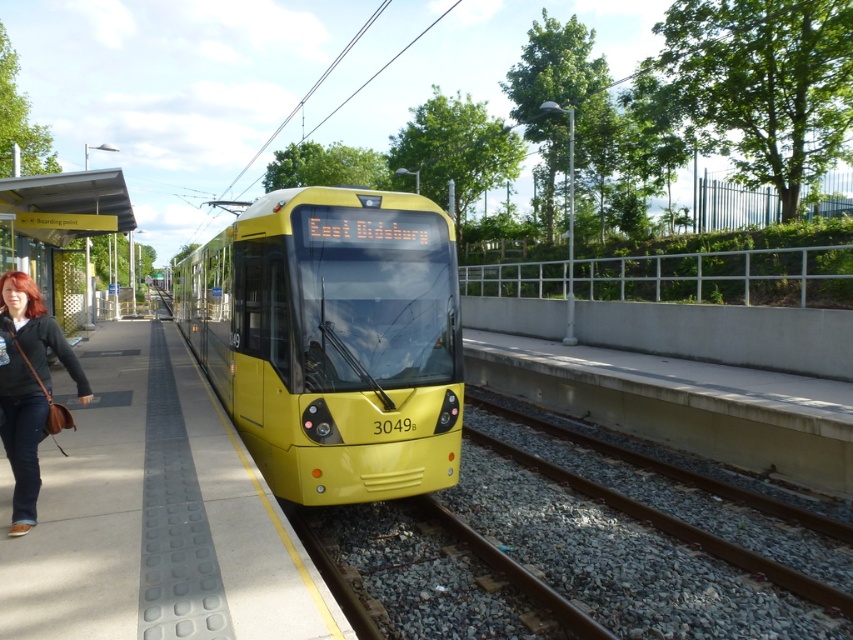
You are standing on the platform waiting for the tram. You have a matte brown leather bag at lower left. Where is your bag in relation to the gravel train track at center?

The matte brown leather bag at lower left is behind the gravel train track at center.

You are a passenger waiting for the tram and notice the gravel train track at center and the matte brown leather bag at lower left. Which object takes up more space in the image?

The gravel train track at center is larger in size than the matte brown leather bag at lower left, so it takes up more space in the image.

You are standing at the platform of the tram station. You want to board the yellow matte train at center. Where exactly should you stand to board the train?

You should stand at point (332, 340) to board the yellow matte train at center.